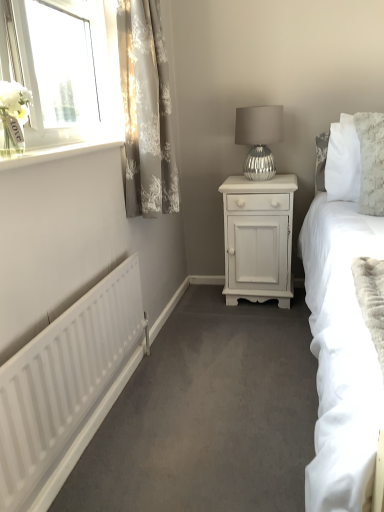
Question: Is silver textured lamp at center located outside gray floral fabric curtain at upper left?

Choices:
 (A) yes
 (B) no

Answer: (A)

Question: Is silver textured lamp at center wider than gray floral fabric curtain at upper left?

Choices:
 (A) yes
 (B) no

Answer: (A)

Question: Does silver textured lamp at center lie in front of gray floral fabric curtain at upper left?

Choices:
 (A) yes
 (B) no

Answer: (B)

Question: Is silver textured lamp at center at the left side of gray floral fabric curtain at upper left?

Choices:
 (A) yes
 (B) no

Answer: (B)

Question: From a real-world perspective, is silver textured lamp at center located beneath gray floral fabric curtain at upper left?

Choices:
 (A) yes
 (B) no

Answer: (A)

Question: Is gray floral fabric curtain at upper left at the back of silver textured lamp at center?

Choices:
 (A) no
 (B) yes

Answer: (A)

Question: Considering the relative sizes of white painted wood at upper left and white matte radiator at lower left in the image provided, is white painted wood at upper left thinner than white matte radiator at lower left?

Choices:
 (A) yes
 (B) no

Answer: (B)

Question: Are white painted wood at upper left and white matte radiator at lower left beside each other?

Choices:
 (A) yes
 (B) no

Answer: (B)

Question: Is white painted wood at upper left turned away from white matte radiator at lower left?

Choices:
 (A) yes
 (B) no

Answer: (B)

Question: Can you confirm if white painted wood at upper left is bigger than white matte radiator at lower left?

Choices:
 (A) yes
 (B) no

Answer: (B)

Question: Considering the relative sizes of white painted wood at upper left and white matte radiator at lower left in the image provided, is white painted wood at upper left smaller than white matte radiator at lower left?

Choices:
 (A) no
 (B) yes

Answer: (B)

Question: Is white painted wood at upper left closer to the viewer compared to white matte radiator at lower left?

Choices:
 (A) yes
 (B) no

Answer: (B)

Question: Is gray floral fabric curtain at upper left to the right of white painted wood nightstand at center from the viewer's perspective?

Choices:
 (A) no
 (B) yes

Answer: (A)